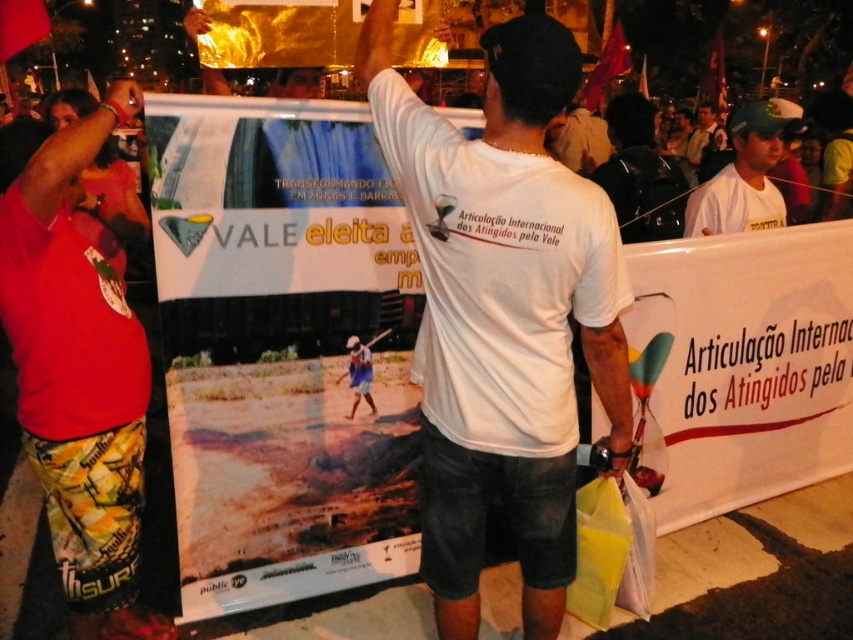
Question: Does matte white banner at center have a lesser width compared to white t-shirt at center?

Choices:
 (A) yes
 (B) no

Answer: (B)

Question: Which of the following is the closest to the observer?

Choices:
 (A) (109, 584)
 (B) (740, 141)

Answer: (A)

Question: Does matte white banner at center come in front of red cotton shirt at left?

Choices:
 (A) no
 (B) yes

Answer: (A)

Question: Which point is farther from the camera taking this photo?

Choices:
 (A) (645, 173)
 (B) (694, 157)
 (C) (263, 435)
 (D) (428, 465)

Answer: (B)

Question: Does matte white banner at center appear over white cotton t-shirt at center?

Choices:
 (A) yes
 (B) no

Answer: (B)

Question: Which object appears farthest from the camera in this image?

Choices:
 (A) black matte backpack at upper center
 (B) white cotton t-shirt at center
 (C) white t-shirt at center
 (D) red cotton shirt at left

Answer: (C)